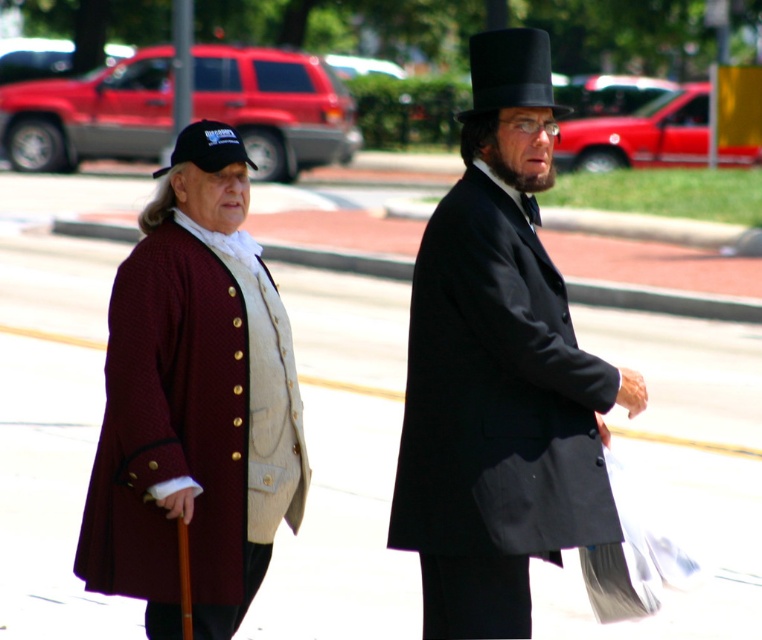
Question: Where is maroon wool coat at center located in relation to matte black coat at center in the image?

Choices:
 (A) right
 (B) left

Answer: (A)

Question: Is the position of matte black coat at center less distant than that of maroon wool coat at left?

Choices:
 (A) yes
 (B) no

Answer: (A)

Question: Which object is closer to the camera taking this photo?

Choices:
 (A) black felt top hat at upper center
 (B) black fabric cap at left

Answer: (A)

Question: Among these points, which one is nearest to the camera?

Choices:
 (A) (444, 292)
 (B) (434, 307)
 (C) (232, 323)

Answer: (A)

Question: Does maroon wool coat at left appear under black felt top hat at upper center?

Choices:
 (A) yes
 (B) no

Answer: (A)

Question: Estimate the real-world distances between objects in this image. Which object is farther from the maroon wool coat at left?

Choices:
 (A) black fabric cap at left
 (B) maroon wool coat at center

Answer: (A)